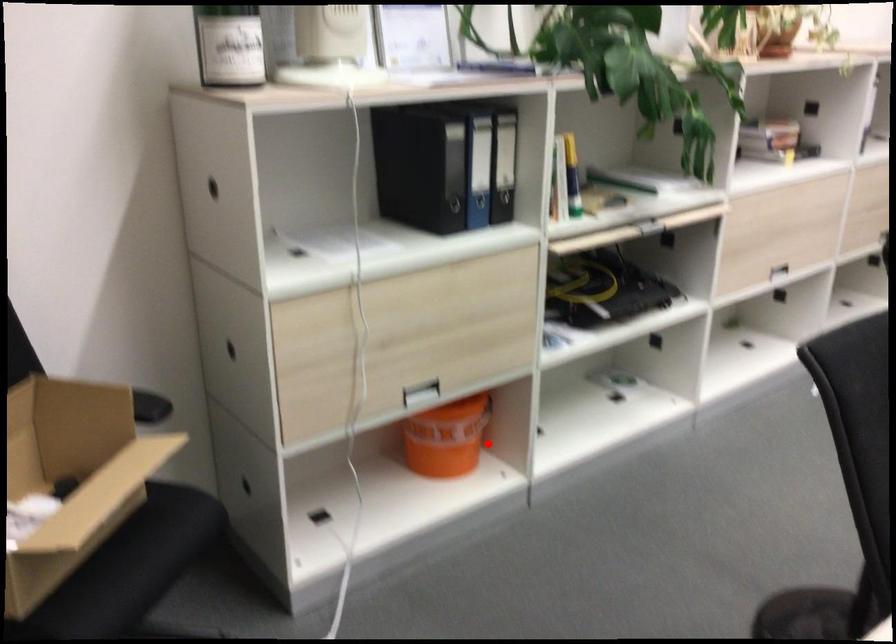
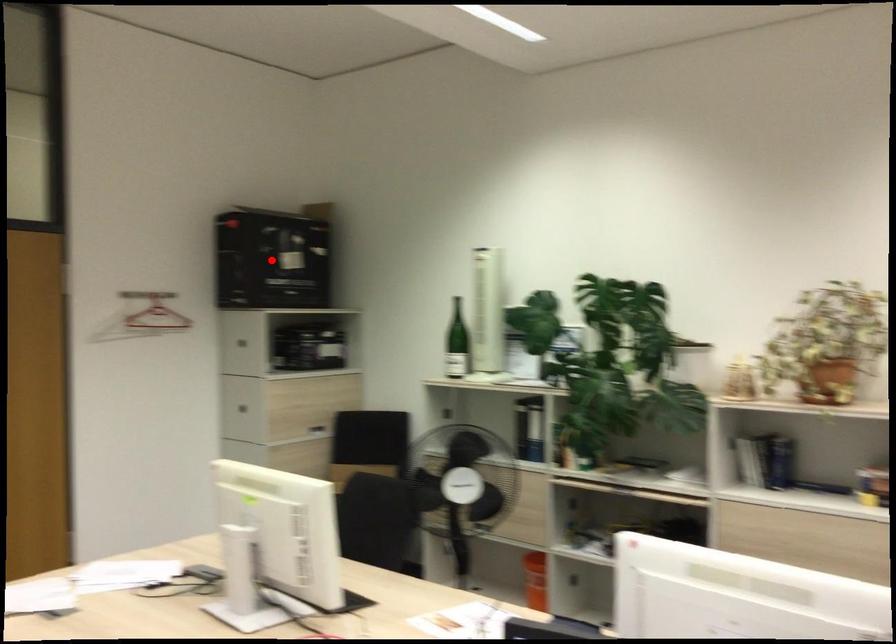
I am providing you with two images of the same scene from different viewpoints. A red point is marked on the first image and another point is marked on the second image. Do the highlighted points in image1 and image2 indicate the same real-world spot?

No